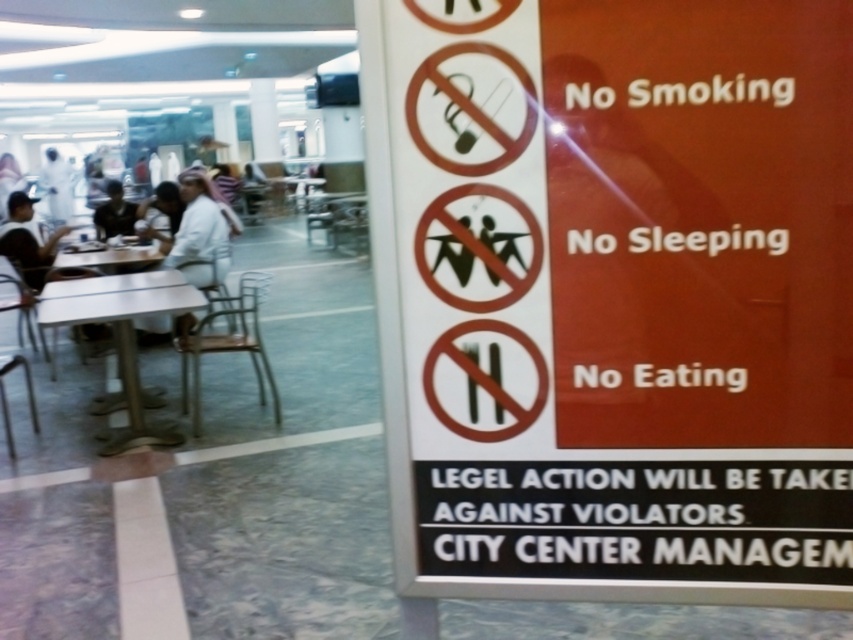
You are a customer looking for a place to eat your meal. You see two tables in the scene, the white glossy table at center and the white plastic table at center. Which table is positioned lower in the image?

The white glossy table at center is located below the white plastic table at center, so it is positioned lower in the image.

You are a security guard in the city center. You see a person wearing a white fabric shirt at left and a matte black cap at left. Which item is positioned more to the right?

The white fabric shirt at left is positioned more to the right than the matte black cap at left.